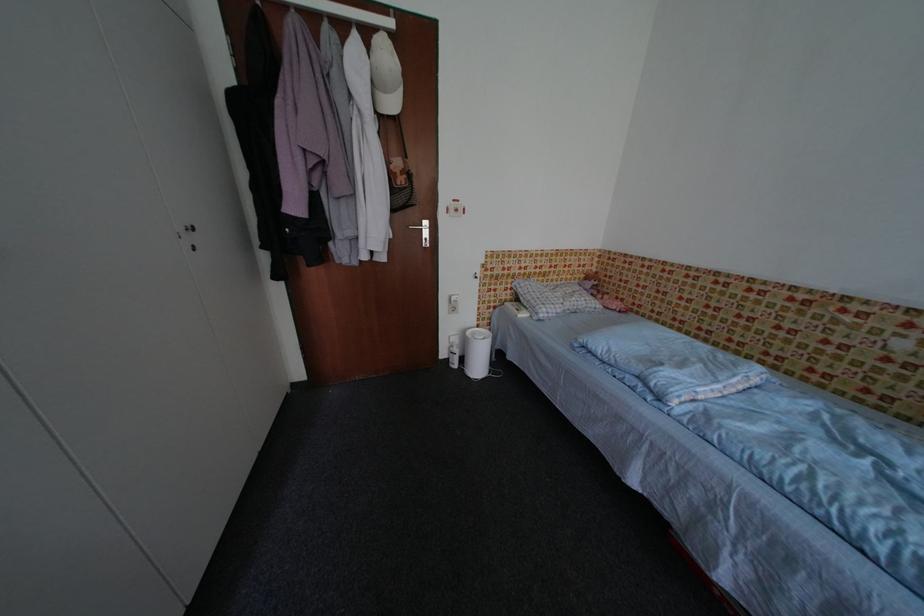
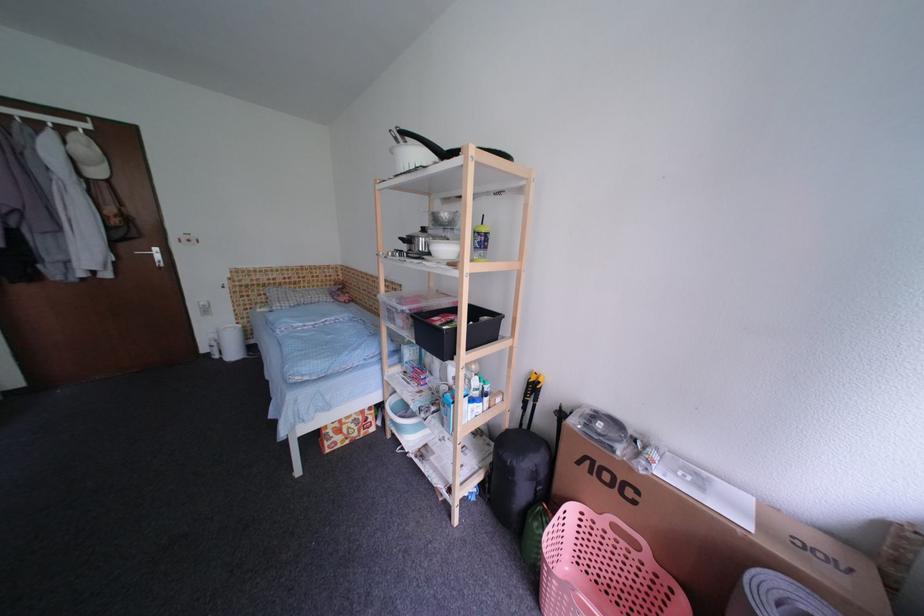
Find the pixel in the second image that matches pixel 464 342 in the first image.

(222, 338)